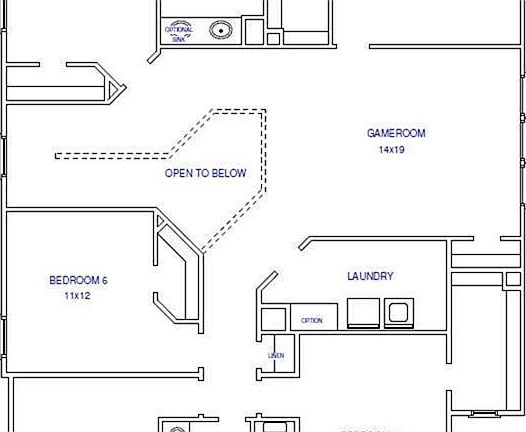
In order to click on room in this screenshot , I will do `click(285, 346)`.